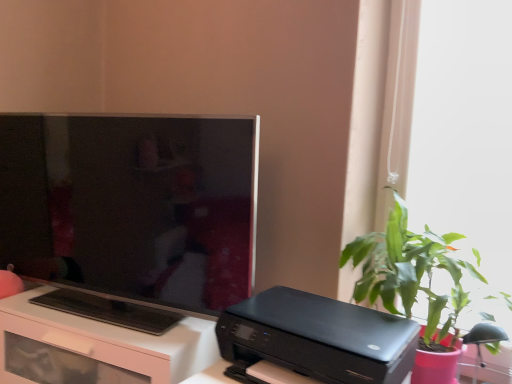
Where is `empty space that is ontop of black glossy printer at lower center`? empty space that is ontop of black glossy printer at lower center is located at coordinates (320, 324).